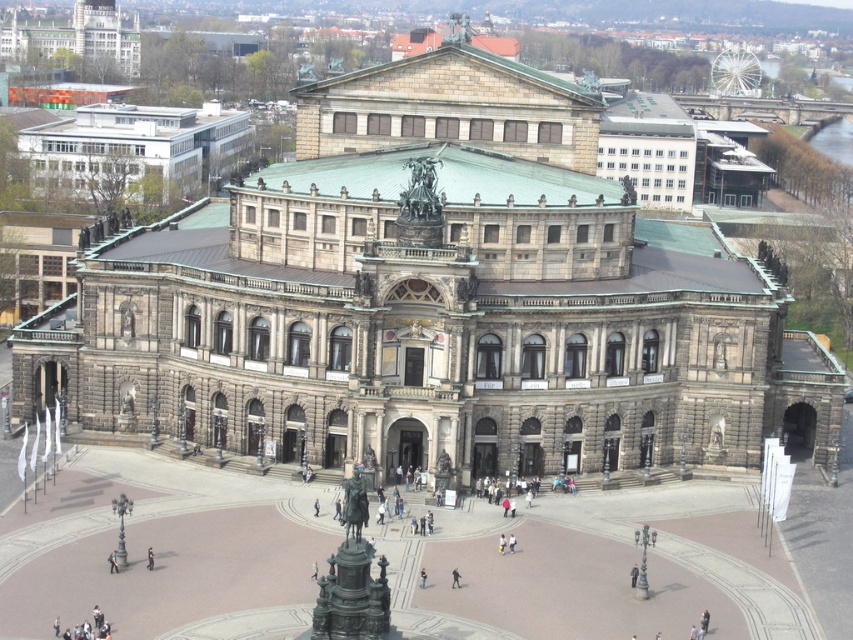
Which is in front, point (453, 576) or point (149, 550)?

Point (453, 576) is in front.

In the scene shown: Is dark gray fabric jacket at center further to camera compared to black fabric person at center?

No.

Image resolution: width=853 pixels, height=640 pixels. I want to click on dark gray fabric jacket at center, so click(456, 577).